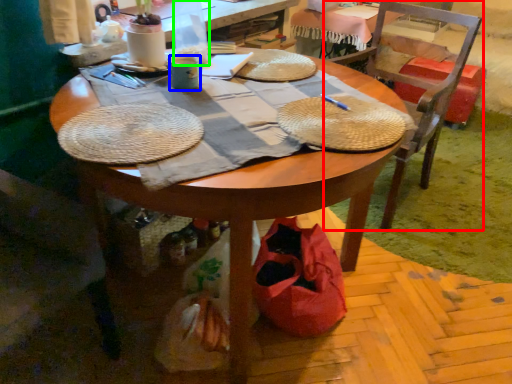
Question: Which object is positioned farthest from chair (highlighted by a red box)? Select from coffee cup (highlighted by a blue box) and bottle (highlighted by a green box).

Choices:
 (A) coffee cup
 (B) bottle

Answer: (A)